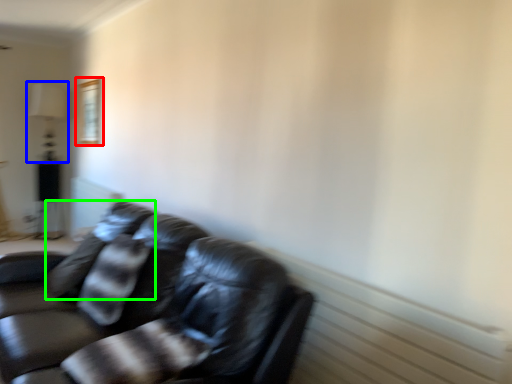
Question: Which object is positioned farthest from picture frame (highlighted by a red box)? Select from lamp (highlighted by a blue box) and pillow (highlighted by a green box).

Choices:
 (A) lamp
 (B) pillow

Answer: (B)